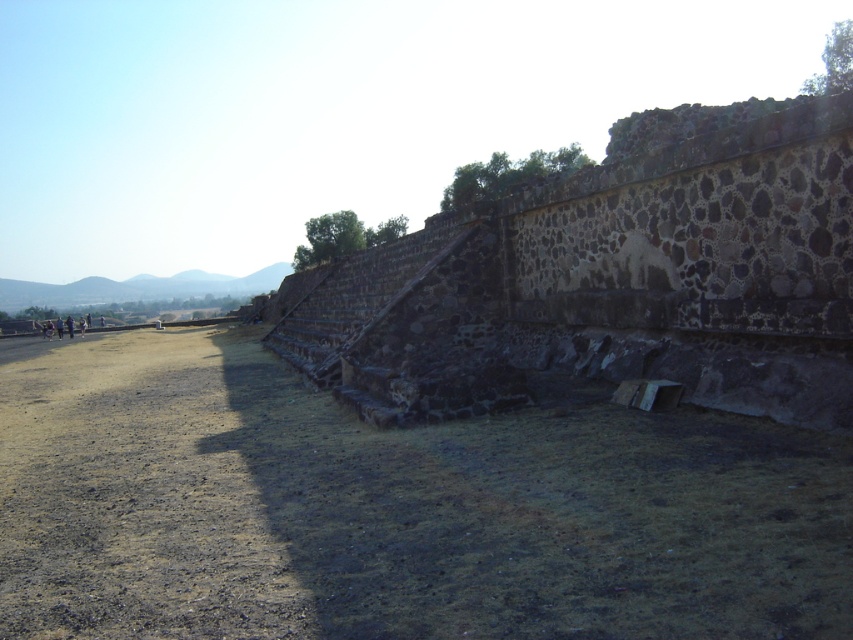
Question: Which of the following is the farthest from the observer?

Choices:
 (A) brown dirt track at lower left
 (B) rustic stone stairs at center
 (C) brown/dry soil at center

Answer: (B)

Question: Does brown/dry soil at center appear on the right side of rustic stone stairs at center?

Choices:
 (A) yes
 (B) no

Answer: (A)

Question: Which object is farther from the camera taking this photo?

Choices:
 (A) brown/dry soil at center
 (B) rustic stone stairs at center

Answer: (B)

Question: Where is brown/dry soil at center located in relation to brown dirt track at lower left in the image?

Choices:
 (A) below
 (B) above

Answer: (B)

Question: Does rustic stone stairs at center have a smaller size compared to brown dirt track at lower left?

Choices:
 (A) no
 (B) yes

Answer: (A)

Question: Which is farther from the brown/dry soil at center?

Choices:
 (A) brown dirt track at lower left
 (B) rustic stone stairs at center

Answer: (B)